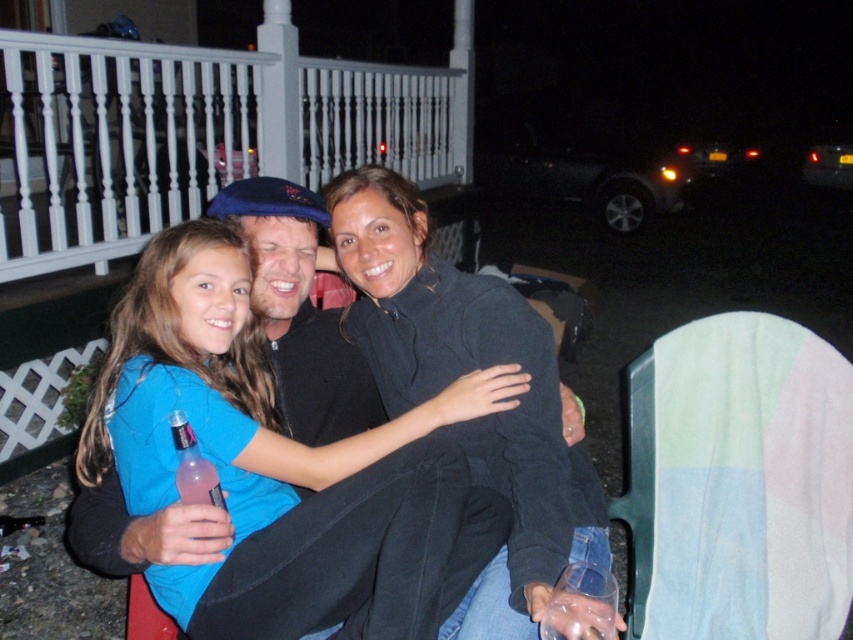
Is point (341, 164) farther from viewer compared to point (244, 371)?

Yes, it is behind point (244, 371).

The height and width of the screenshot is (640, 853). I want to click on white painted wood railing at upper left, so click(x=194, y=134).

Is blue cotton shirt at center above dark gray sweater at center?

Actually, blue cotton shirt at center is below dark gray sweater at center.

This screenshot has width=853, height=640. I want to click on blue cotton shirt at center, so click(361, 532).

Can you confirm if white painted wood railing at upper left is positioned to the left of pink translucent bottle at lower left?

Indeed, white painted wood railing at upper left is positioned on the left side of pink translucent bottle at lower left.

Can you confirm if white painted wood railing at upper left is taller than pink translucent bottle at lower left?

Yes.

Between point (457, 145) and point (173, 422), which one is positioned behind?

The point (457, 145) is behind.

You are a GUI agent. You are given a task and a screenshot of the screen. Output one action in this format:
    pyautogui.click(x=<x>, y=<y>)
    Task: Click on the white painted wood railing at upper left
    This screenshot has height=640, width=853.
    Given the screenshot: What is the action you would take?
    pyautogui.click(x=194, y=134)